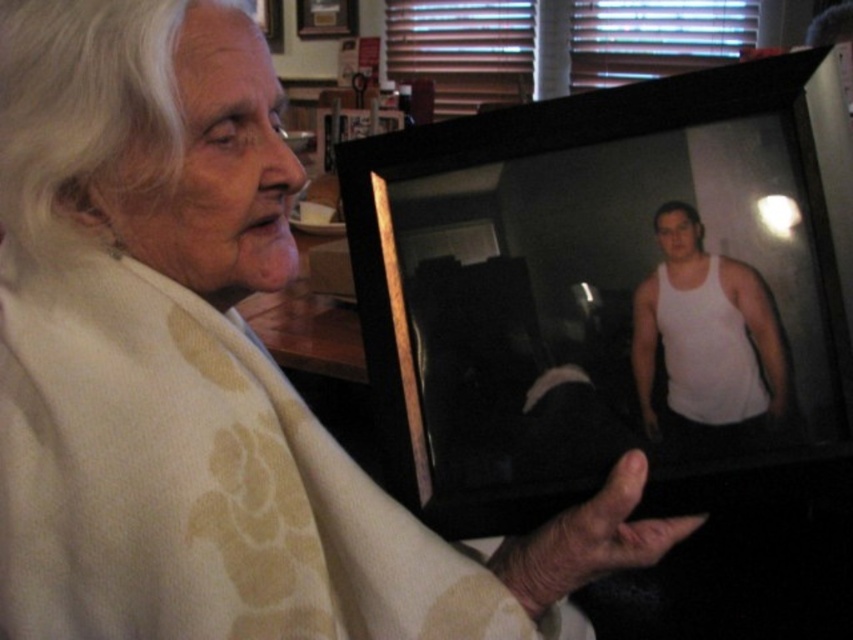
Does point (561, 220) come in front of point (776, 387)?

No, it is not.

Between point (373, 180) and point (693, 444), which one is positioned behind?

The point (373, 180) is behind.

At what (x,y) coordinates should I click in order to perform the action: click on black plastic picture frame at center. Please return your answer as a coordinate pair (x, y). Looking at the image, I should click on (613, 291).